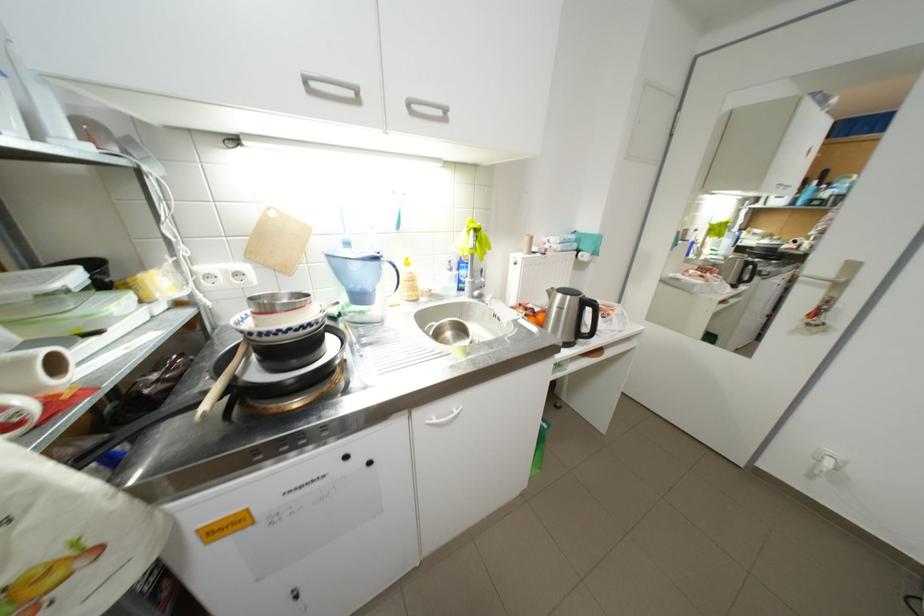
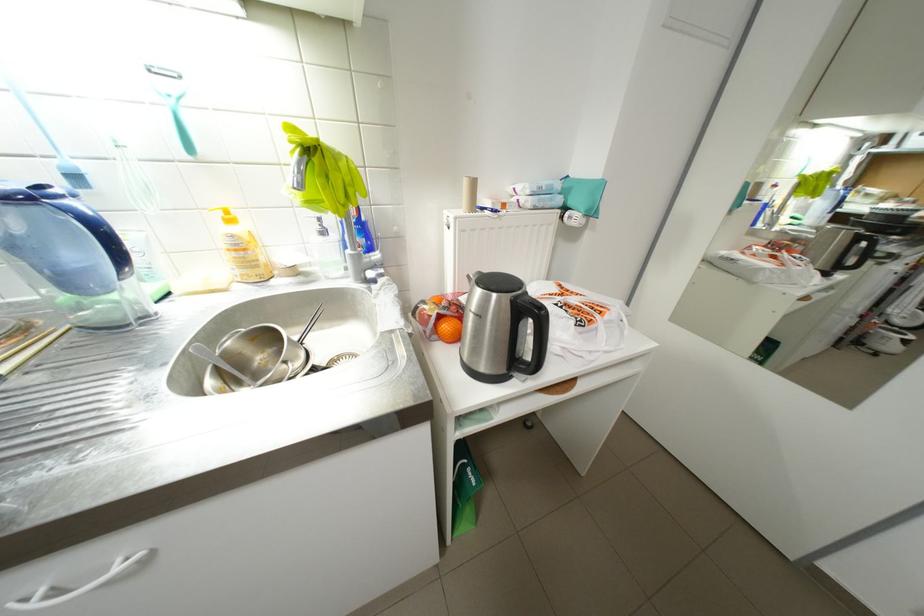
Question: The images are taken continuously from a first-person perspective. In which direction is your viewpoint rotating?

Choices:
 (A) Left
 (B) Right
 (C) Up
 (D) Down

Answer: (D)